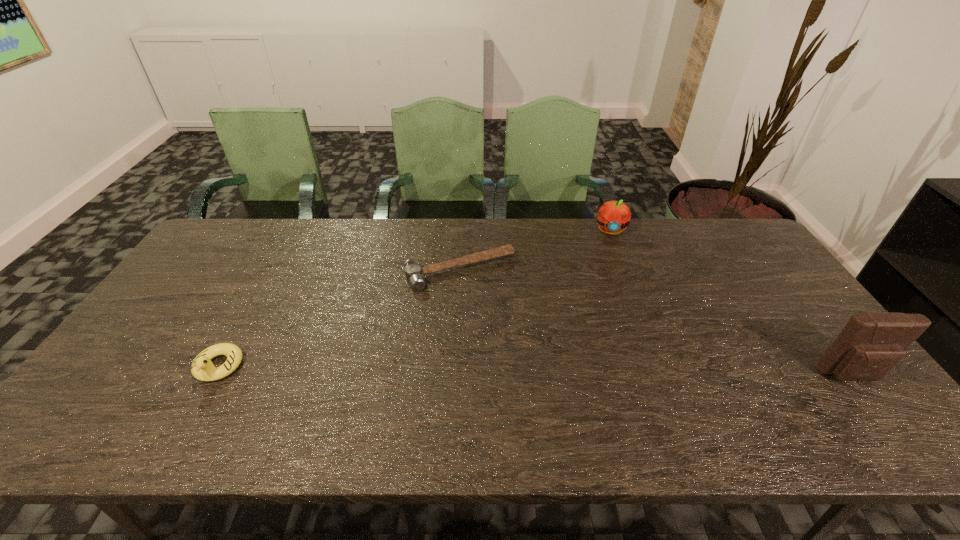
The width and height of the screenshot is (960, 540). Find the location of `the leftmost object`. the leftmost object is located at coordinates (202, 368).

The width and height of the screenshot is (960, 540). I want to click on duckling, so click(202, 368).

The width and height of the screenshot is (960, 540). I want to click on pouch, so click(x=871, y=344).

The width and height of the screenshot is (960, 540). What are the coordinates of `the rightmost object` in the screenshot? It's located at (871, 344).

You are a GUI agent. You are given a task and a screenshot of the screen. Output one action in this format:
    pyautogui.click(x=<x>, y=<y>)
    Task: Click on the second farthest object
    
    Given the screenshot: What is the action you would take?
    pyautogui.click(x=413, y=272)

In order to click on hammer in this screenshot , I will do `click(413, 272)`.

Locate an element on the screen. The image size is (960, 540). the farthest object is located at coordinates [x=613, y=216].

Identify the location of apple. (613, 216).

Identify the location of free region located on the striking face of the shortest object. (511, 345).

This screenshot has width=960, height=540. I want to click on vacant space positioned on the striking face of the shortest object, so click(x=528, y=373).